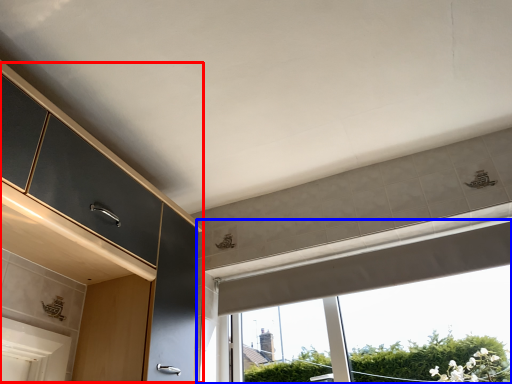
Question: Which object appears closest to the camera in this image, dresser (highlighted by a red box) or window (highlighted by a blue box)?

Choices:
 (A) dresser
 (B) window

Answer: (A)